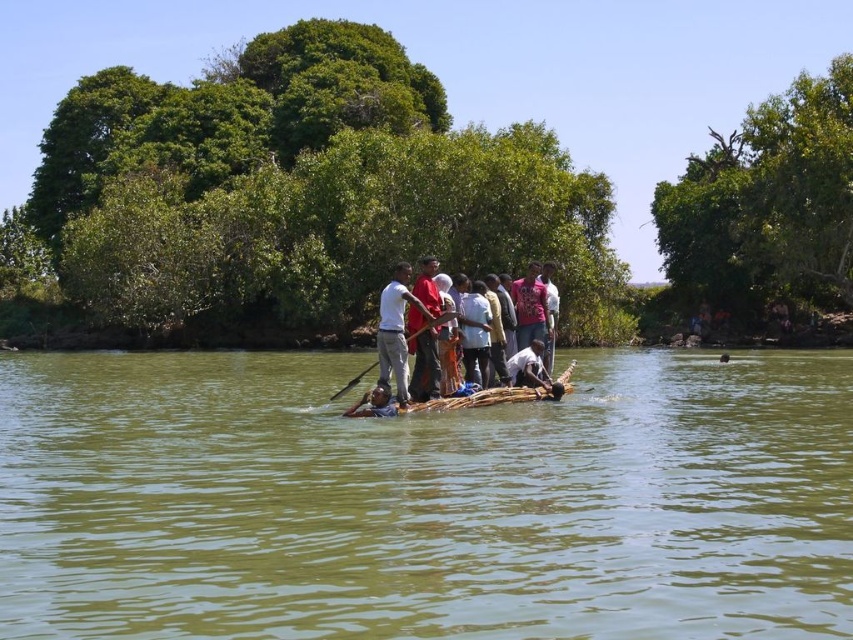
Based on the photo, you are on a raft in a tropical river. You need to reach for an item to stop the raft from tipping over. Which item is closer to your hand? The white cotton shirt at center or the wooden paddle at center?

The white cotton shirt at center is located above the wooden paddle at center, so it is closer to your hand.

You are on a raft floating down a river and see two people wearing a white matte shirt at center and a red fabric shirt at center. Which shirt is visible higher up on the person?

The white matte shirt at center is located above the red fabric shirt at center, so the white matte shirt at center is visible higher up on the person.